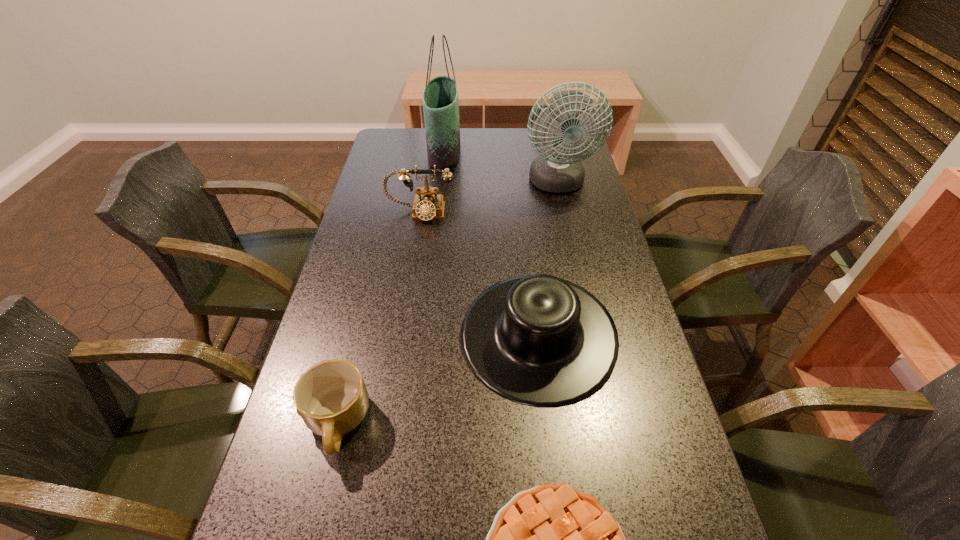
Locate an element on the screen. tote bag is located at coordinates (440, 97).

This screenshot has height=540, width=960. I want to click on fan, so click(560, 171).

Where is `telephone`? This screenshot has width=960, height=540. telephone is located at coordinates (427, 205).

Find the location of a particular element. Image resolution: width=960 pixels, height=540 pixels. dress hat is located at coordinates (539, 340).

Find the location of a particular element. Image resolution: width=960 pixels, height=540 pixels. the second shortest object is located at coordinates (331, 397).

This screenshot has height=540, width=960. I want to click on vacant area situated 0.070m on the front of the tote bag, so click(x=441, y=183).

Where is `vacant region located 0.170m in front of the fan where the airflow is directed`? The width and height of the screenshot is (960, 540). vacant region located 0.170m in front of the fan where the airflow is directed is located at coordinates (569, 240).

What are the coordinates of `free space located on the dial number of the telephone` in the screenshot? It's located at (410, 276).

Where is `vacant area located on the back of the dress hat`? This screenshot has width=960, height=540. vacant area located on the back of the dress hat is located at coordinates (524, 218).

The width and height of the screenshot is (960, 540). What are the coordinates of `free spot located 0.060m on the side with the handle of the mug` in the screenshot? It's located at (318, 502).